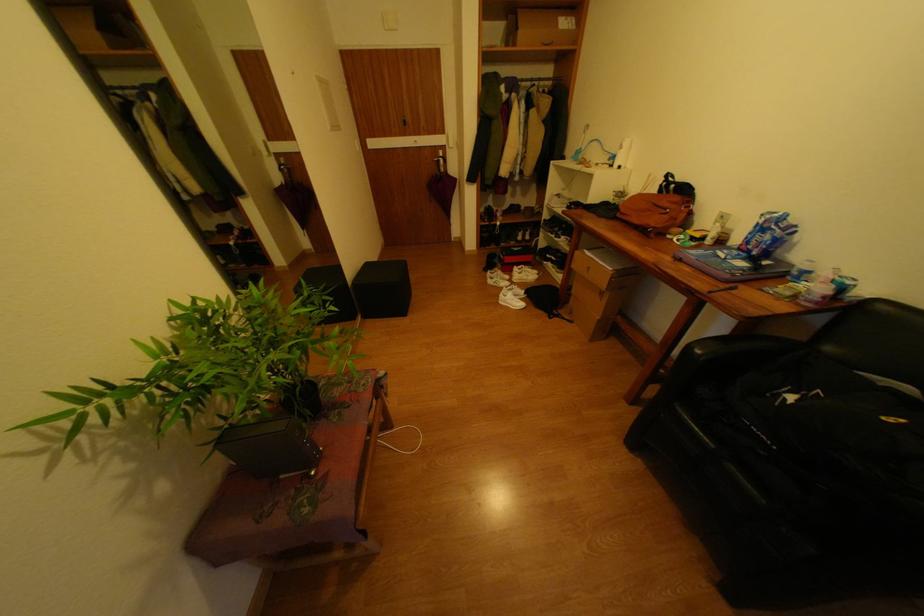
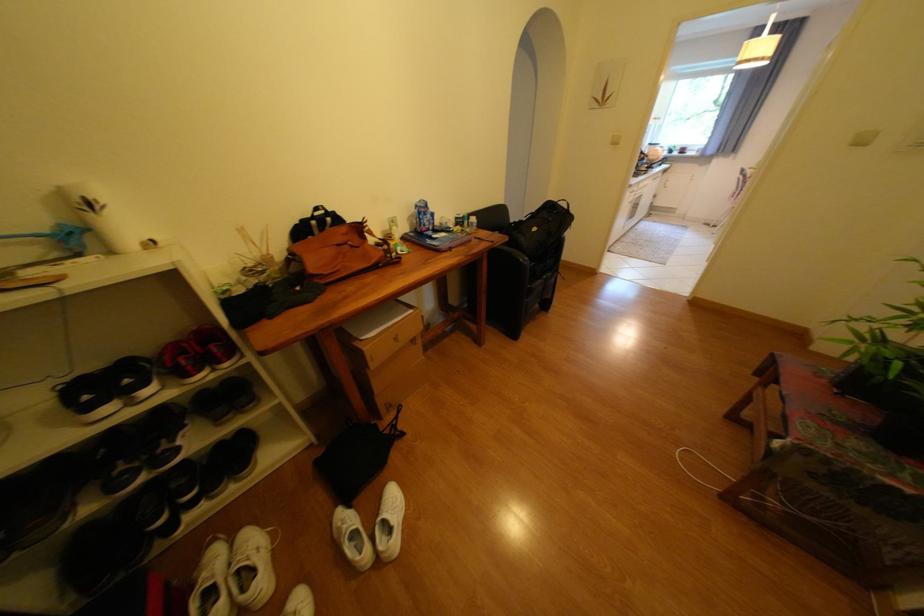
The point at (686, 199) is marked in the first image. Where is the corresponding point in the second image?

(351, 229)